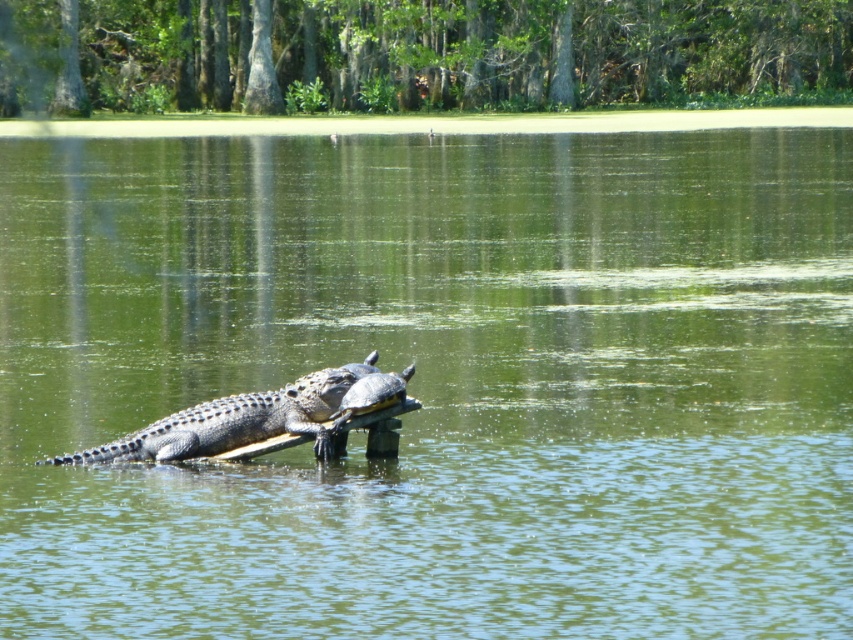
Looking at this image, is leathery brown crocodile at center above smooth gray crocodile at center?

No, leathery brown crocodile at center is not above smooth gray crocodile at center.

Can you confirm if leathery brown crocodile at center is positioned to the left of smooth gray crocodile at center?

Yes, leathery brown crocodile at center is to the left of smooth gray crocodile at center.

Where is `leathery brown crocodile at center`? leathery brown crocodile at center is located at coordinates (235, 420).